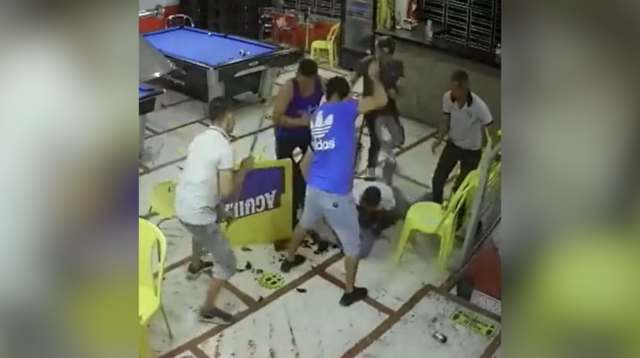
Locate all where a person would sit in the image. Your answer should be formatted as a list of tuples, i.e. [(x1, y1), (x2, y2), ...], where each tuple contains the x and y coordinates of a point satisfying the conditions above.

[(320, 44), (428, 217), (143, 304)]